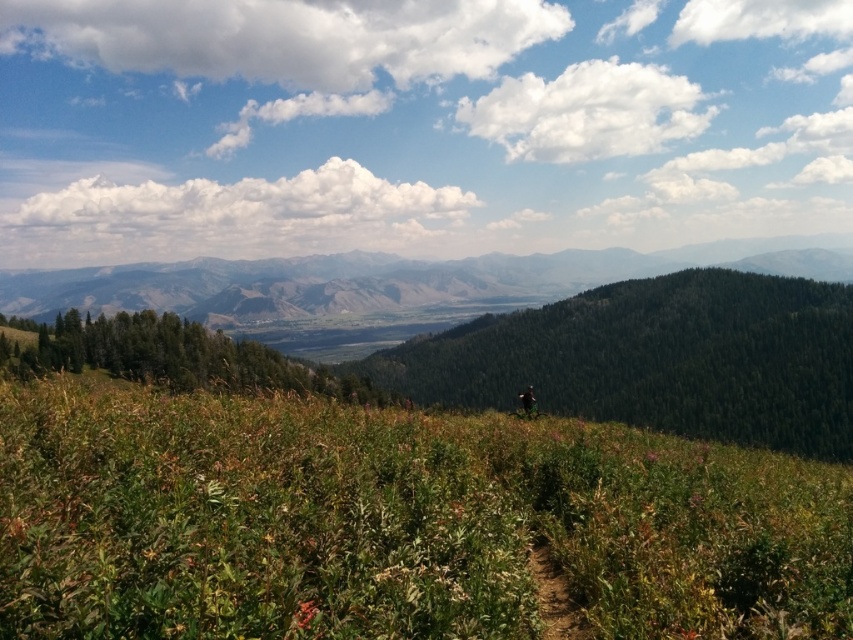
Does green leafy grass at center have a smaller size compared to green forested mountain at center?

Indeed, green leafy grass at center has a smaller size compared to green forested mountain at center.

Between point (100, 593) and point (383, 266), which one is positioned behind?

Positioned behind is point (383, 266).

Find the location of a particular element. green leafy grass at center is located at coordinates 395,522.

Can you confirm if green forested mountain at center is bigger than green matte jacket at center?

Indeed, green forested mountain at center has a larger size compared to green matte jacket at center.

Does green forested mountain at center have a lesser width compared to green matte jacket at center?

No.

Identify the location of green forested mountain at center. The height and width of the screenshot is (640, 853). (387, 280).

Does green leafy grass at center appear over green matte jacket at center?

Yes.

The height and width of the screenshot is (640, 853). Describe the element at coordinates (395, 522) in the screenshot. I see `green leafy grass at center` at that location.

Is point (607, 493) positioned behind point (525, 388)?

No, it is not.

At what (x,y) coordinates should I click in order to perform the action: click on green leafy grass at center. Please return your answer as a coordinate pair (x, y). Looking at the image, I should click on (395, 522).